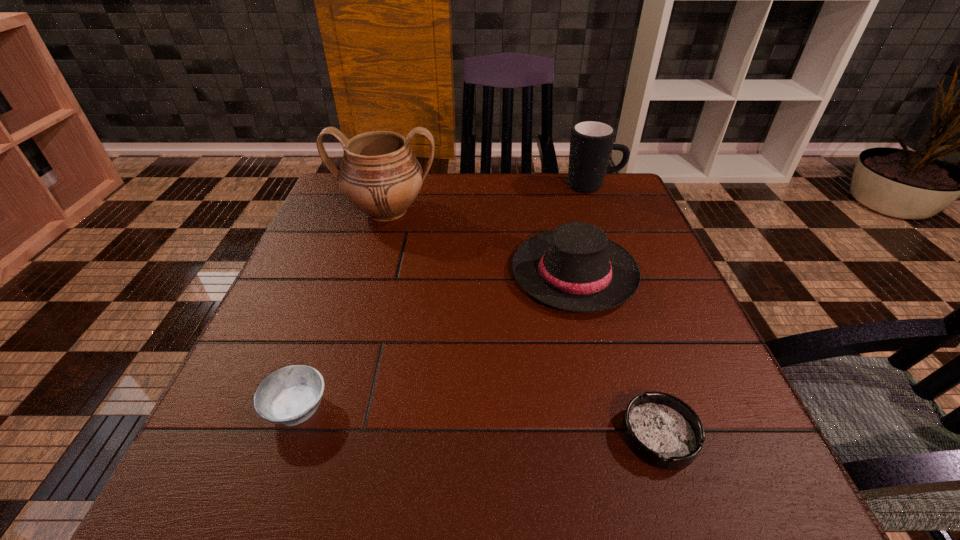
Find the location of a particular element. Image resolution: width=960 pixels, height=540 pixels. vacant area located 0.200m on the back of the taller ashtray is located at coordinates (335, 300).

At what (x,y) coordinates should I click in order to perform the action: click on vacant space situated on the left of the shortest object. Please return your answer as a coordinate pair (x, y). Image resolution: width=960 pixels, height=540 pixels. Looking at the image, I should click on (440, 435).

Where is `urn located at the far edge`? The width and height of the screenshot is (960, 540). urn located at the far edge is located at coordinates (379, 175).

Find the location of a particular element. The height and width of the screenshot is (540, 960). mug located at the far edge is located at coordinates (591, 143).

Where is `object situated at the near edge`? object situated at the near edge is located at coordinates (661, 429).

This screenshot has width=960, height=540. Find the location of `urn that is at the left edge`. urn that is at the left edge is located at coordinates (379, 175).

Find the location of `ashtray present at the left edge`. ashtray present at the left edge is located at coordinates (289, 396).

Find the location of `mug positioned at the right edge`. mug positioned at the right edge is located at coordinates (591, 143).

This screenshot has height=540, width=960. What are the coordinates of `dress hat located in the right edge section of the desktop` in the screenshot? It's located at (576, 268).

At what (x,y) coordinates should I click in order to perform the action: click on ashtray that is positioned at the right edge. Please return your answer as a coordinate pair (x, y). This screenshot has height=540, width=960. Looking at the image, I should click on (661, 429).